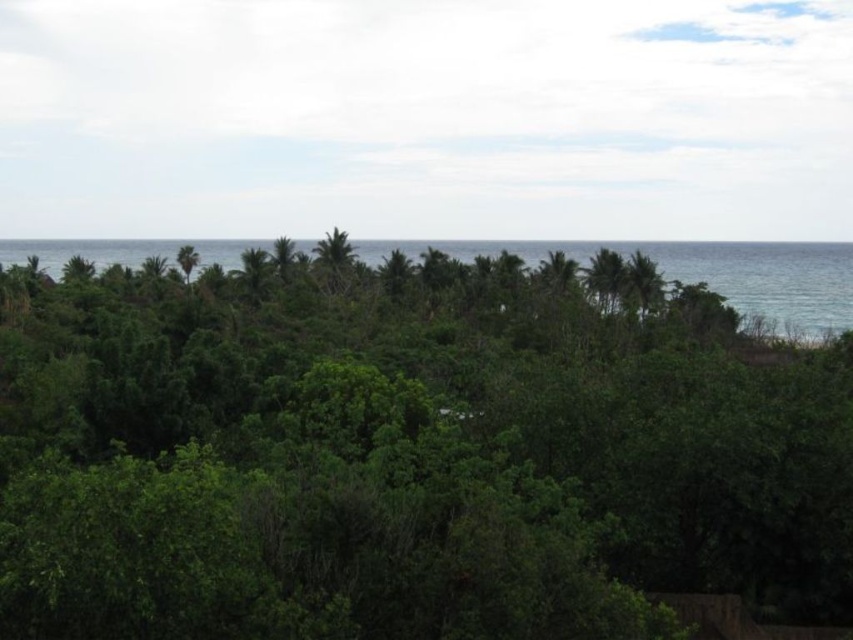
You are standing in a tropical forest and see the blue water at upper center and the green leafy tree at upper right. Which object is located to the left of the other?

The blue water at upper center is positioned on the left side of green leafy tree at upper right.

You are standing at the center of a lush tropical forest. You see a point marked at coordinates (405, 452). What object is located at that point?

The point at coordinates (405, 452) corresponds to a green leafy tree at center.